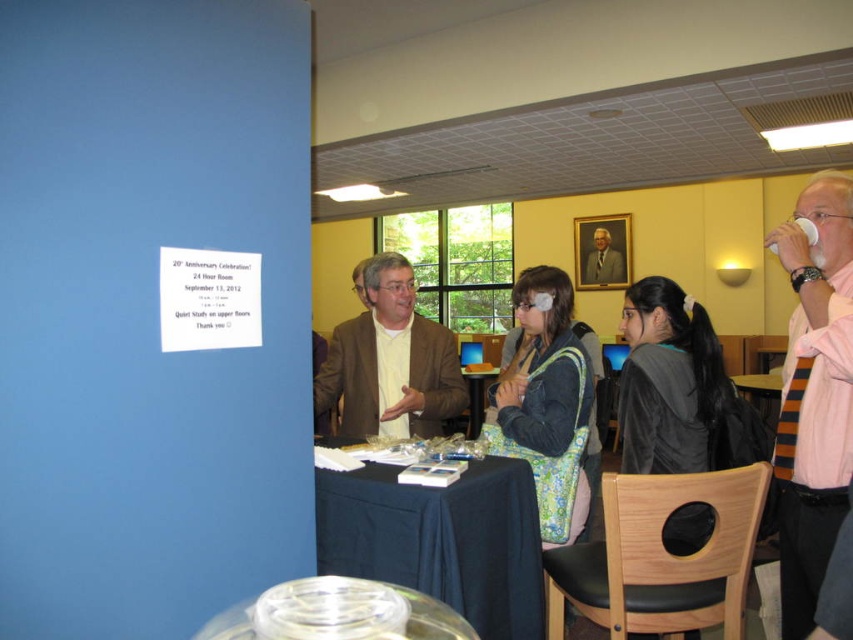
Question: In this image, where is pink striped tie at right located relative to black plastic table at center?

Choices:
 (A) left
 (B) right

Answer: (B)

Question: Is black clothed table at center to the left of formal suit at center from the viewer's perspective?

Choices:
 (A) no
 (B) yes

Answer: (B)

Question: Which point appears closest to the camera in this image?

Choices:
 (A) (392, 278)
 (B) (793, 339)
 (C) (408, 544)
 (D) (608, 266)

Answer: (C)

Question: Which is nearer to the black plastic table at center?

Choices:
 (A) matte brown jacket at center
 (B) pink striped tie at right

Answer: (A)

Question: Where is pink striped tie at right located in relation to formal suit at center in the image?

Choices:
 (A) above
 (B) below

Answer: (B)

Question: Which object is the closest to the formal suit at center?

Choices:
 (A) black plastic table at center
 (B) pink striped tie at right
 (C) black clothed table at center
 (D) matte brown jacket at center

Answer: (A)